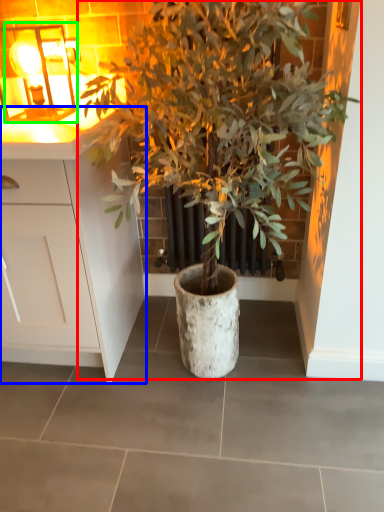
Question: Based on their relative distances, which object is nearer to houseplant (highlighted by a red box)? Choose from cabinetry (highlighted by a blue box) and light fixture (highlighted by a green box).

Choices:
 (A) cabinetry
 (B) light fixture

Answer: (A)